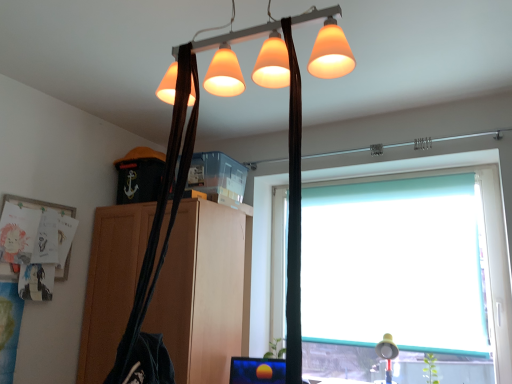
Question: Is matte white lampshade at lower right wider or thinner than teal roller blind at right?

Choices:
 (A) wide
 (B) thin

Answer: (A)

Question: Based on their positions, is matte white lampshade at lower right located to the left or right of teal roller blind at right?

Choices:
 (A) left
 (B) right

Answer: (A)

Question: Based on their relative distances, which object is nearer to the matte orange lampshade at upper center?

Choices:
 (A) teal roller blind at right
 (B) matte white lampshade at lower right
 (C) wooden cabinet at center

Answer: (C)

Question: Which object is the farthest from the matte orange lampshade at upper center?

Choices:
 (A) matte white lampshade at lower right
 (B) wooden cabinet at center
 (C) teal roller blind at right

Answer: (A)